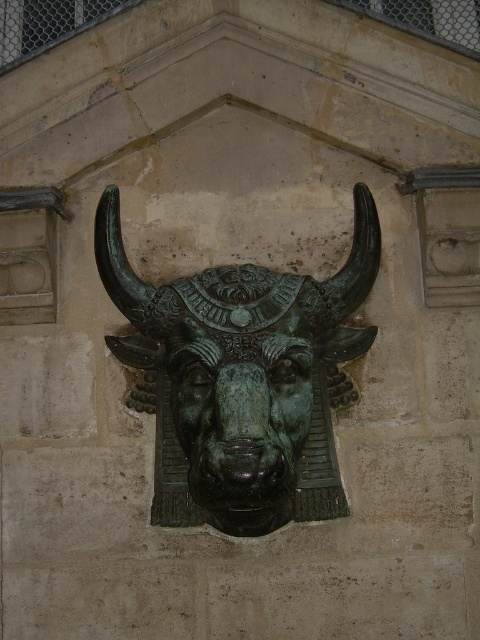
Question: Can you confirm if green patina bull at center is smaller than green patina bull head at center?

Choices:
 (A) yes
 (B) no

Answer: (B)

Question: Is green patina bull at center positioned behind green patina bull head at center?

Choices:
 (A) yes
 (B) no

Answer: (A)

Question: Among these objects, which one is farthest from the camera?

Choices:
 (A) green patina bull head at center
 (B) green patina bull at center

Answer: (B)

Question: Can you confirm if green patina bull at center is smaller than green patina bull head at center?

Choices:
 (A) yes
 (B) no

Answer: (B)